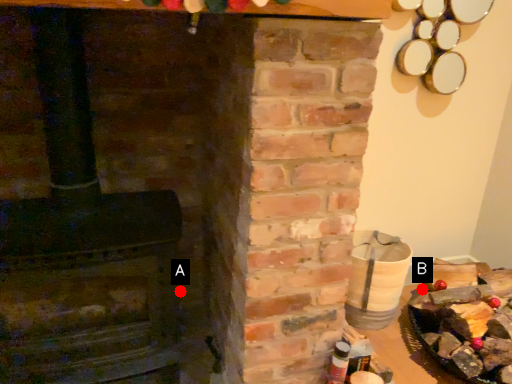
Question: Two points are circled on the image, labeled by A and B beside each circle. Which of the following is the closest to the observer?

Choices:
 (A) A is closer
 (B) B is closer

Answer: (A)